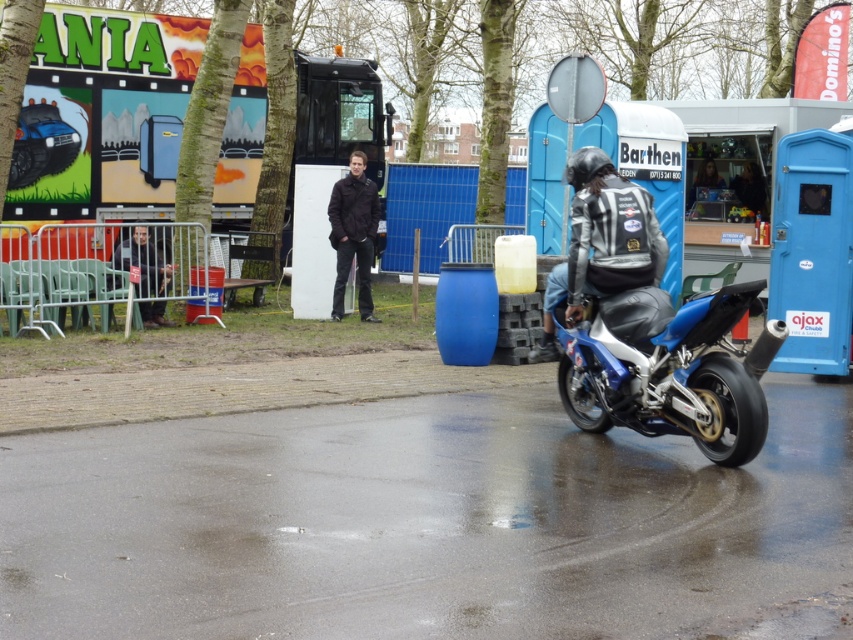
Who is more distant from viewer, (614,396) or (144,243)?

Point (144,243)

Where is `blue metallic motorcycle at lower right`? This screenshot has height=640, width=853. blue metallic motorcycle at lower right is located at coordinates (669, 369).

Is shiny black jacket at center positioned in front of dark brown leather jacket at center?

Yes, it is in front of dark brown leather jacket at center.

Can you confirm if shiny black jacket at center is positioned below dark brown leather jacket at center?

Indeed, shiny black jacket at center is positioned under dark brown leather jacket at center.

Identify the location of shiny black jacket at center. (601, 243).

Which is above, blue metallic motorcycle at lower right or shiny black jacket at center?

shiny black jacket at center is above.

Image resolution: width=853 pixels, height=640 pixels. What do you see at coordinates (669, 369) in the screenshot? I see `blue metallic motorcycle at lower right` at bounding box center [669, 369].

Is point (682, 433) behind point (596, 246)?

No, (682, 433) is closer to viewer.

This screenshot has height=640, width=853. What are the coordinates of `blue metallic motorcycle at lower right` in the screenshot? It's located at coord(669,369).